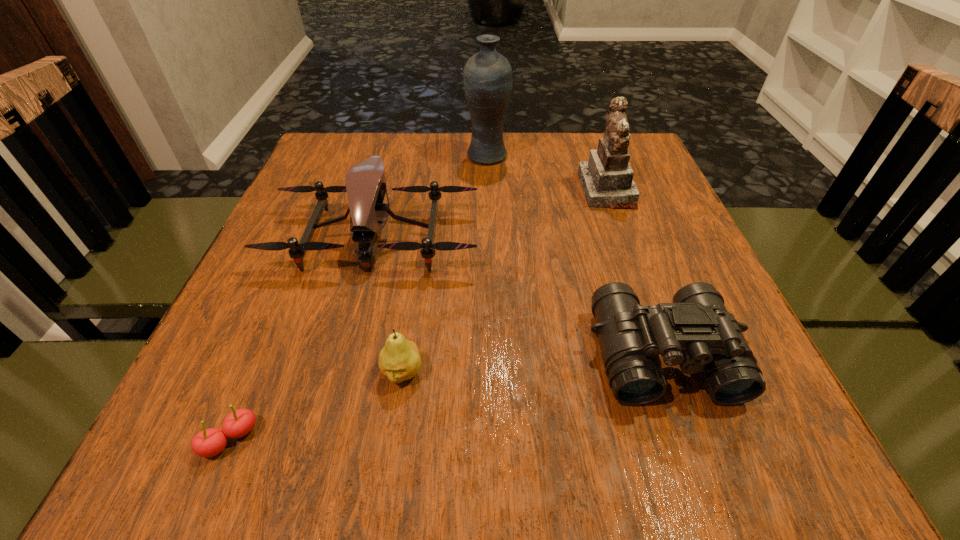
The height and width of the screenshot is (540, 960). Identify the location of cherry that is at the left edge. point(210,442).

Locate an element on the screen. This screenshot has width=960, height=540. figurine situated at the right edge is located at coordinates (607, 178).

Where is `binoculars that is at the right edge`? Image resolution: width=960 pixels, height=540 pixels. binoculars that is at the right edge is located at coordinates (696, 332).

At what (x,y) coordinates should I click in order to perform the action: click on object that is positioned at the near left corner. Please return your answer as a coordinate pair (x, y). Looking at the image, I should click on coord(210,442).

Where is `object present at the far right corner`? object present at the far right corner is located at coordinates (607, 178).

The width and height of the screenshot is (960, 540). In order to click on vacant space at the far edge of the desktop in this screenshot , I will do pyautogui.click(x=437, y=147).

In the image, there is a desktop. Where is `free space at the left edge`? The image size is (960, 540). free space at the left edge is located at coordinates (245, 320).

In the image, there is a desktop. Where is `blank space at the right edge`? blank space at the right edge is located at coordinates (694, 246).

Locate an element on the screen. The width and height of the screenshot is (960, 540). blank space at the far left corner is located at coordinates (384, 133).

Identify the location of vacant space at the far right corner. (635, 171).